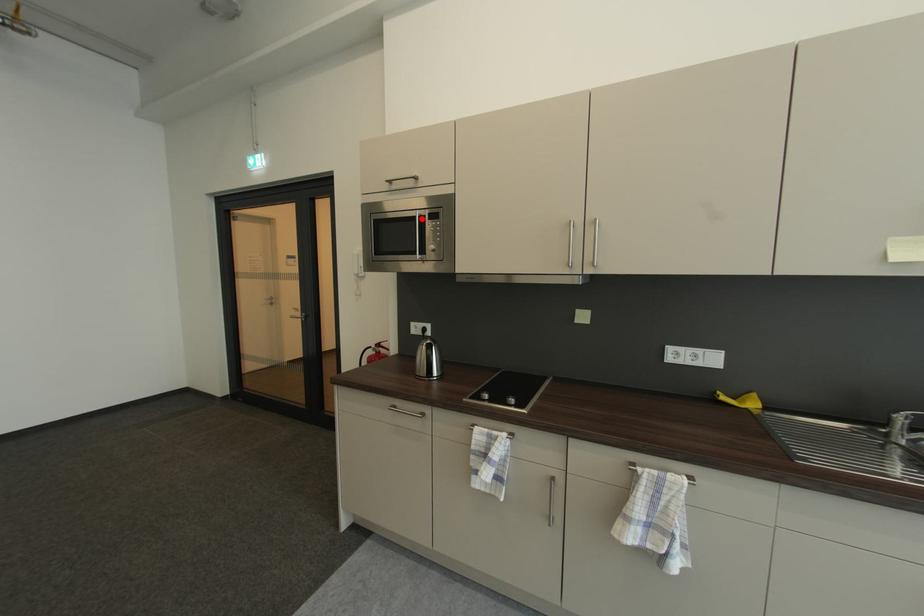
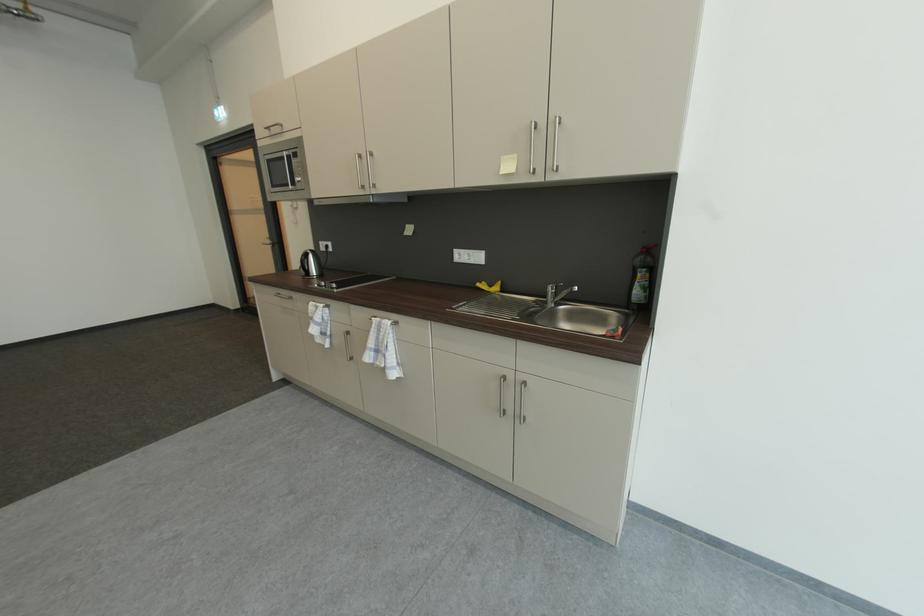
Where in the second image is the point corresponding to the highlighted location from the first image?

(290, 158)